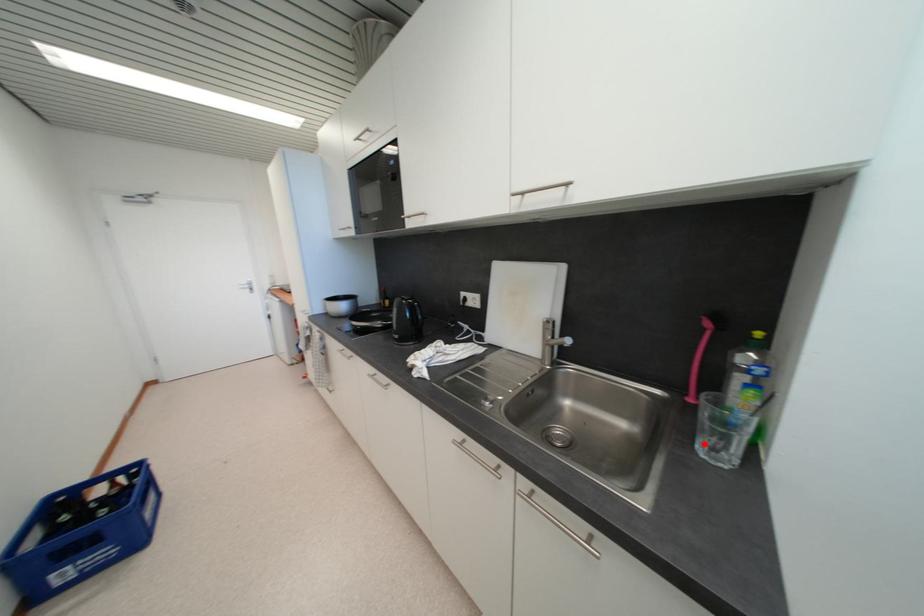
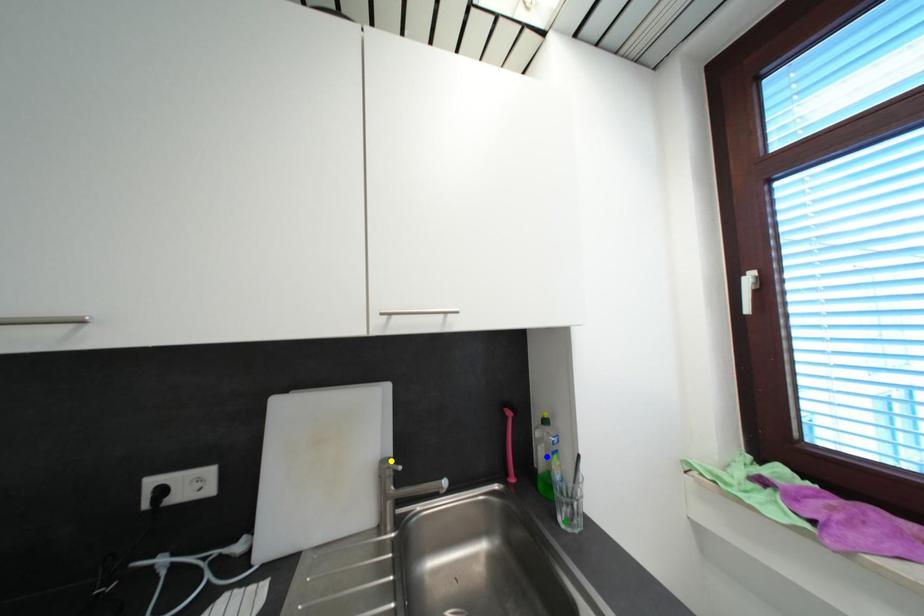
Question: I am providing you with two images of the same scene from different viewpoints. A red point is marked on the first image. You are given multiple points on the second image. Which mark in image 2 goes with the point in image 1?

Choices:
 (A) yellow point
 (B) blue point
 (C) green point

Answer: (C)